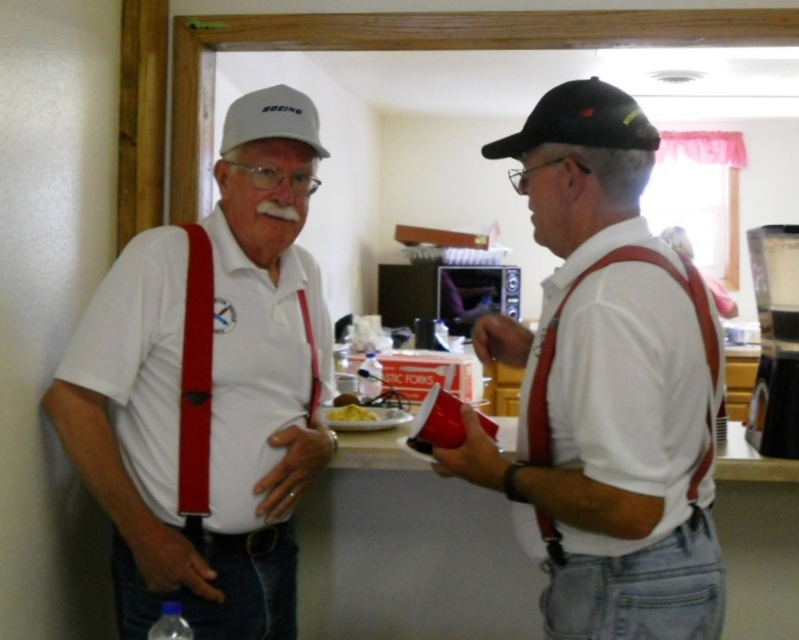
You are a photographer setting up for a group photo in this room. The two baseball caps need to be placed exactly 16 inches apart for the shot. Given their current positions, do you need to move either the black matte baseball cap at upper right or the white matte baseball cap at upper left to achieve the required distance?

The current distance between the black matte baseball cap at upper right and the white matte baseball cap at upper left is 15.39 inches. To reach the required 16 inches, you would need to move one or both caps slightly farther apart.

Two people are talking in a room. The person on the left is wearing a gray baseball cap with Boeing written on it. The person on the right is wearing a black matte baseball cap at upper right. How far apart are they?

They are 3.91 feet apart.

You are trying to decide which cap to choose based on height. Both the matte black cap at upper right and the black matte baseball cap at upper right are options. Which one is taller?

The matte black cap at upper right is taller than the black matte baseball cap at upper right according to the description.